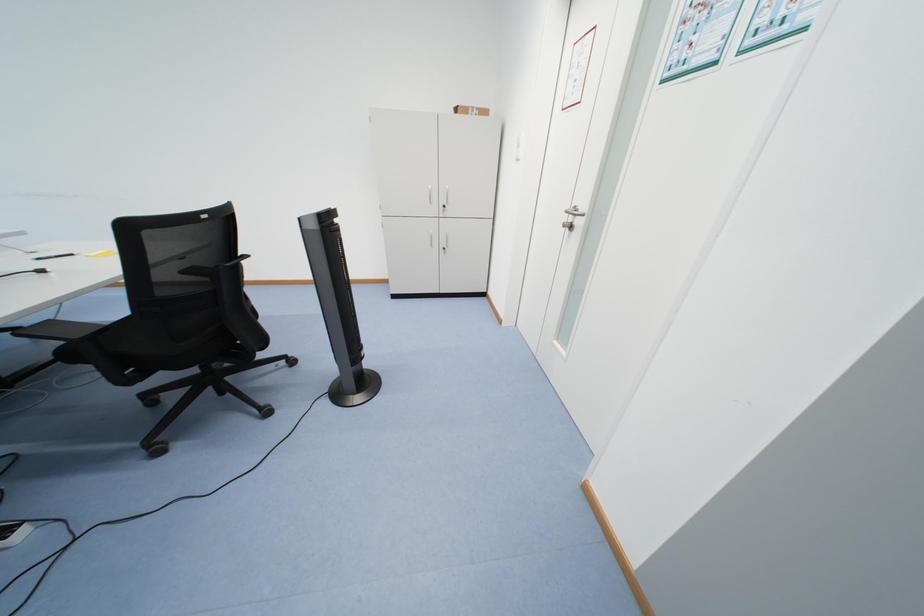
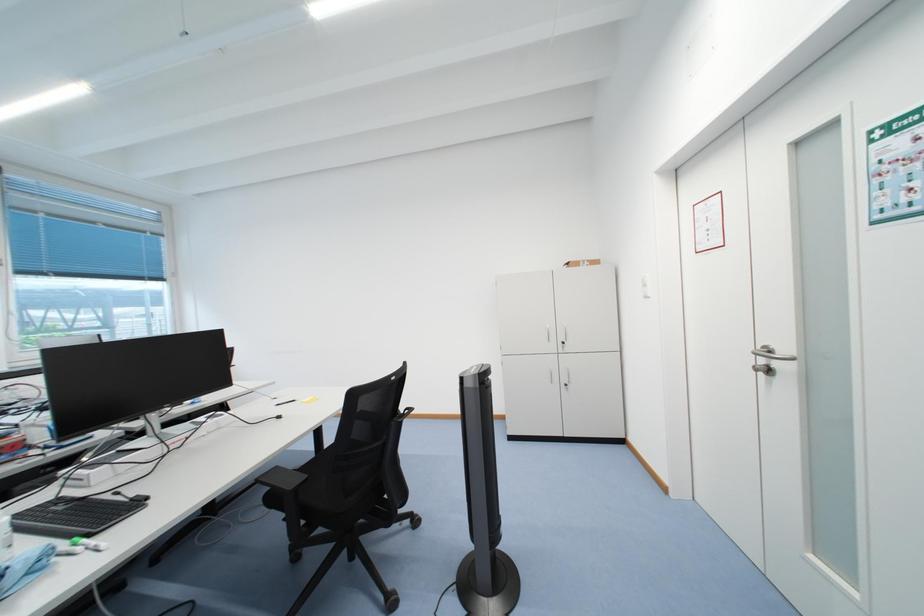
First-person continuous shooting, in which direction is the camera rotating?

The camera's rotation is toward left-up.